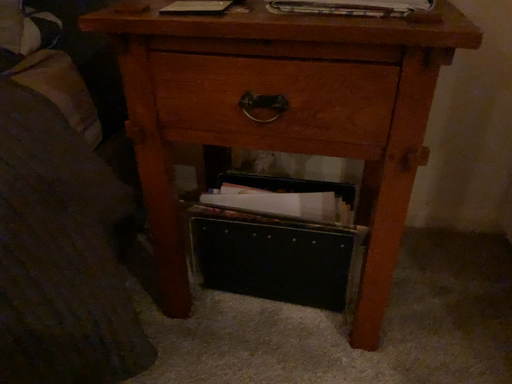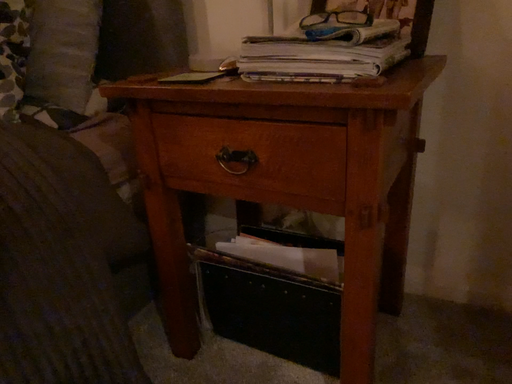
Question: Which way did the camera rotate in the video?

Choices:
 (A) rotated upward
 (B) rotated downward

Answer: (A)